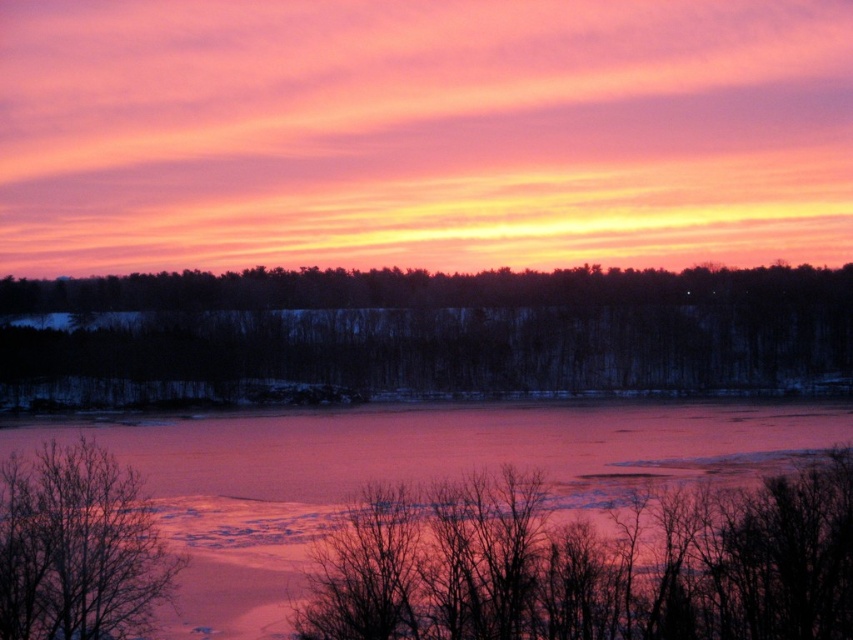
You are an artist sketching the winter scene. You want to draw the dark brown bark at center and the bare branches at lower left. According to the scene, which object is positioned to the right of the other?

The dark brown bark at center is positioned to the right of the bare branches at lower left.

You are a photographer standing at the edge of the frozen lake. You want to capture a photo that includes both the dark brown bark at center and the bare branches at lower left. Given that your camera has a maximum focus range of 80 meters, will you be able to focus on both objects simultaneously?

The dark brown bark at center is 82.51 meters from the bare branches at lower left. Since the distance exceeds the camera maximum focus range of 80 meters, you cannot focus on both objects simultaneously.

You are an artist trying to paint the winter scene. You notice the pink ice at center and the bare branches at lower left. Which object is closer to you, the artist, when you look at the image?

The pink ice at center is closer to you than the bare branches at lower left because it is further to the viewer.